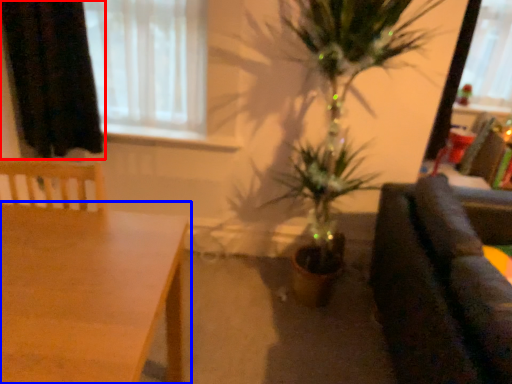
Question: Which point is further to the camera, curtain (highlighted by a red box) or table (highlighted by a blue box)?

Choices:
 (A) curtain
 (B) table

Answer: (A)